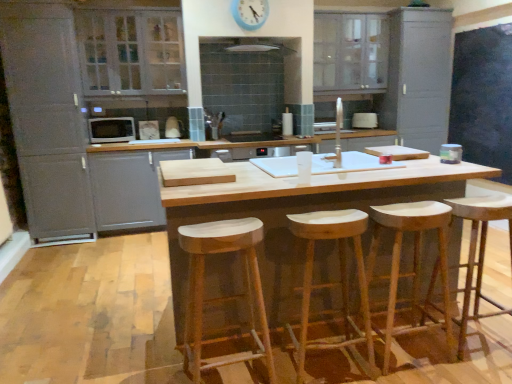
I want to click on free spot below natural wood bar stool at center (from a real-world perspective), so (x=478, y=344).